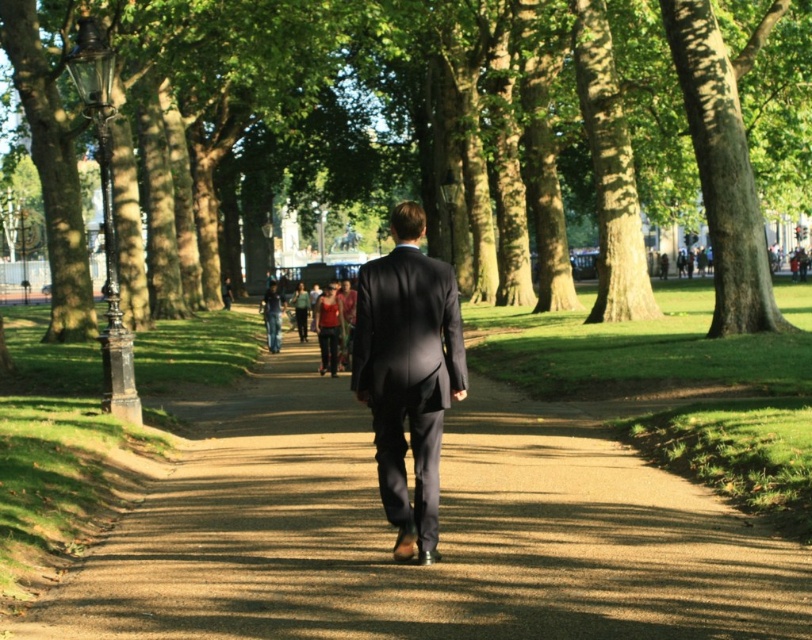
Question: Is the position of green leafy tree at center less distant than that of matte red shirt at center?

Choices:
 (A) yes
 (B) no

Answer: (A)

Question: Is brown gravel path at center smaller than matte red shirt at center?

Choices:
 (A) yes
 (B) no

Answer: (B)

Question: Does green leafy tree at center have a smaller size compared to matte red shirt at center?

Choices:
 (A) no
 (B) yes

Answer: (A)

Question: Which point is closer to the camera taking this photo?

Choices:
 (A) (404, 554)
 (B) (577, 566)
 (C) (340, 342)

Answer: (B)

Question: Which point is closer to the camera?

Choices:
 (A) (379, 435)
 (B) (324, 348)
 (C) (127, 580)
 (D) (50, 202)

Answer: (C)

Question: Among these objects, which one is nearest to the camera?

Choices:
 (A) dark gray suit at center
 (B) green leafy tree at center
 (C) brown gravel path at center

Answer: (C)